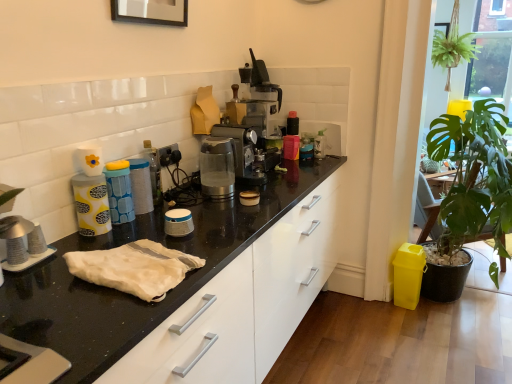
Question: Can you confirm if transparent plastic coffee machine at center, positioned as the first coffee machine in front-to-back order, is positioned to the left of white fabric at center?

Choices:
 (A) no
 (B) yes

Answer: (A)

Question: Does transparent plastic coffee machine at center, positioned as the first coffee machine in front-to-back order, have a lesser width compared to white fabric at center?

Choices:
 (A) yes
 (B) no

Answer: (A)

Question: From a real-world perspective, is transparent plastic coffee machine at center, positioned as the first coffee machine in front-to-back order, over white fabric at center?

Choices:
 (A) yes
 (B) no

Answer: (A)

Question: Is transparent plastic coffee machine at center, the 2th coffee machine in the back-to-front sequence, closer to the viewer compared to white fabric at center?

Choices:
 (A) yes
 (B) no

Answer: (B)

Question: Is transparent plastic coffee machine at center, positioned as the first coffee machine in front-to-back order, smaller than white fabric at center?

Choices:
 (A) no
 (B) yes

Answer: (A)

Question: From the image's perspective, is white fabric at center above or below green leafy plant at right?

Choices:
 (A) below
 (B) above

Answer: (A)

Question: Considering their positions, is white fabric at center located in front of or behind green leafy plant at right?

Choices:
 (A) behind
 (B) front

Answer: (B)

Question: From a real-world perspective, is white fabric at center physically located above or below green leafy plant at right?

Choices:
 (A) above
 (B) below

Answer: (A)

Question: Is point (65, 256) positioned closer to the camera than point (490, 170)?

Choices:
 (A) closer
 (B) farther

Answer: (A)

Question: From the image's perspective, relative to green leafy plant at right, is transparent plastic coffee machine at center, positioned as the first coffee machine in front-to-back order, above or below?

Choices:
 (A) above
 (B) below

Answer: (A)

Question: Is transparent plastic coffee machine at center, positioned as the first coffee machine in front-to-back order, spatially inside green leafy plant at right, or outside of it?

Choices:
 (A) inside
 (B) outside

Answer: (B)

Question: From their relative heights in the image, would you say transparent plastic coffee machine at center, positioned as the first coffee machine in front-to-back order, is taller or shorter than green leafy plant at right?

Choices:
 (A) tall
 (B) short

Answer: (B)

Question: Considering the positions of point (222, 155) and point (485, 205), is point (222, 155) closer or farther from the camera than point (485, 205)?

Choices:
 (A) farther
 (B) closer

Answer: (B)

Question: Looking at the image, does transparent plastic coffee machine at center, the 2th coffee machine in the back-to-front sequence, seem bigger or smaller compared to white fabric at center?

Choices:
 (A) big
 (B) small

Answer: (A)

Question: Is transparent plastic coffee machine at center, positioned as the first coffee machine in front-to-back order, in front of or behind white fabric at center in the image?

Choices:
 (A) front
 (B) behind

Answer: (B)